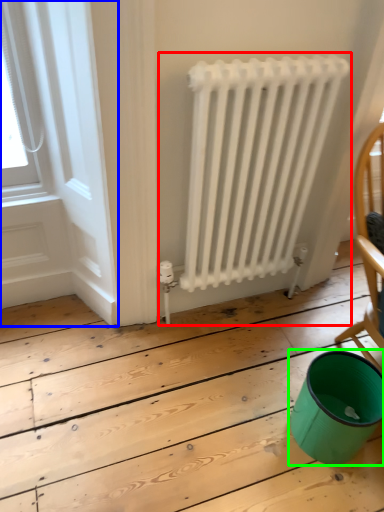
Question: Estimate the real-world distances between objects in this image. Which object is closer to radiator (highlighted by a red box), window frame (highlighted by a blue box) or teal (highlighted by a green box)?

Choices:
 (A) window frame
 (B) teal

Answer: (A)